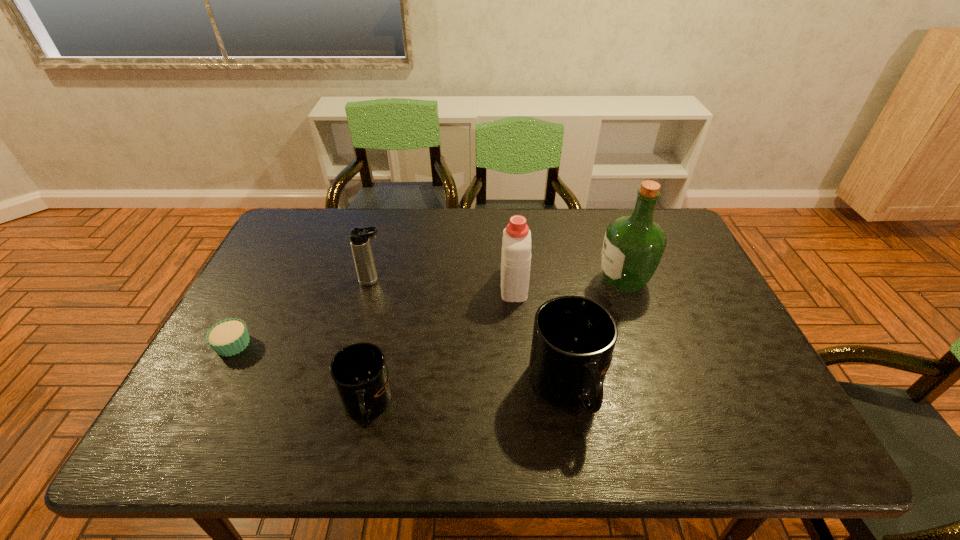
Given the evenly spaced mugs in the image, where should an extra mug be added on the right to preserve the spacing? Please point to a vacant space. Please provide its 2D coordinates. Your answer should be formatted as a tuple, i.e. [(x, y)], where the tuple contains the x and y coordinates of a point satisfying the conditions above.

[(756, 371)]